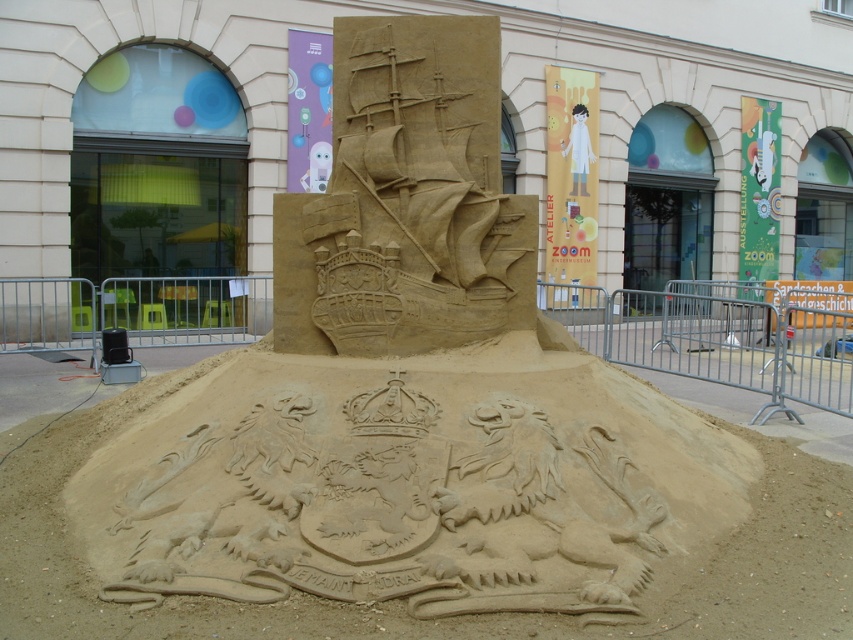
Does natural sand at center have a greater height compared to sandy ship at center?

No, natural sand at center is not taller than sandy ship at center.

Is point (151, 417) closer to viewer compared to point (340, 269)?

No.

Looking at this image, who is more forward, (61, 582) or (341, 260)?

Point (61, 582) is more forward.

This screenshot has width=853, height=640. I want to click on natural sand at center, so click(x=415, y=508).